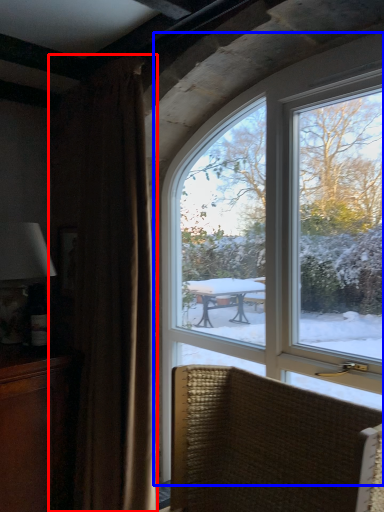
Question: Which object is closer to the camera taking this photo, curtain (highlighted by a red box) or window (highlighted by a blue box)?

Choices:
 (A) curtain
 (B) window

Answer: (B)